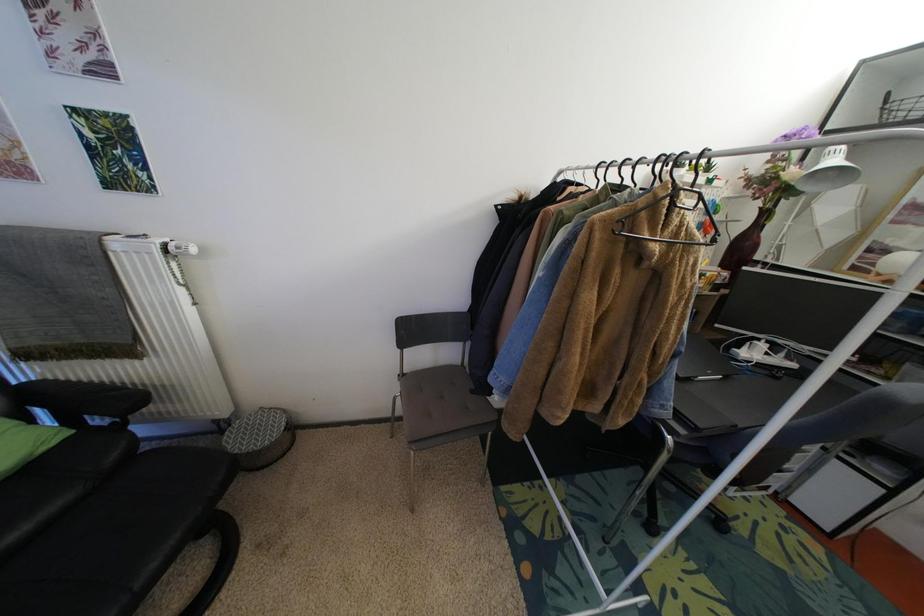
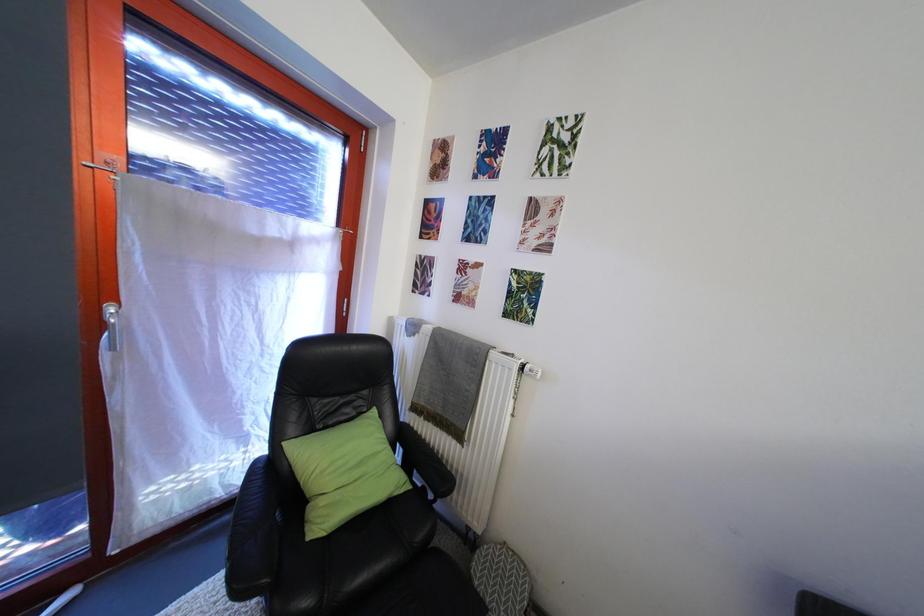
Question: The images are taken continuously from a first-person perspective. In which direction is your viewpoint rotating?

Choices:
 (A) Left
 (B) Right
 (C) Up
 (D) Down

Answer: (A)